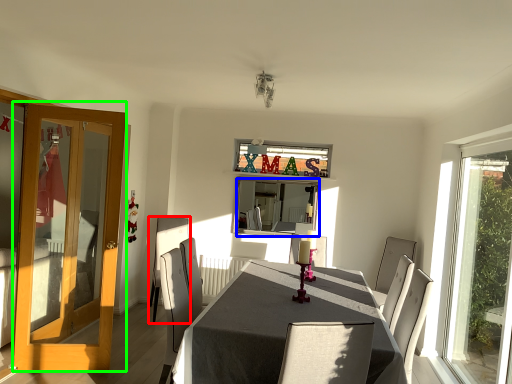
Question: Which object is the closest to the chair (highlighted by a red box)? Choose among these: mirror (highlighted by a blue box) or door (highlighted by a green box).

Choices:
 (A) mirror
 (B) door

Answer: (A)